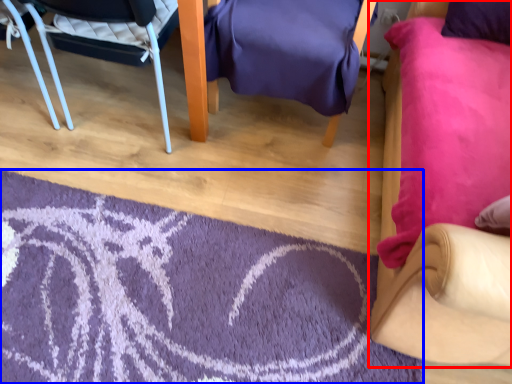
Question: Which object appears farthest to the camera in this image, chair (highlighted by a red box) or mat (highlighted by a blue box)?

Choices:
 (A) chair
 (B) mat

Answer: (B)